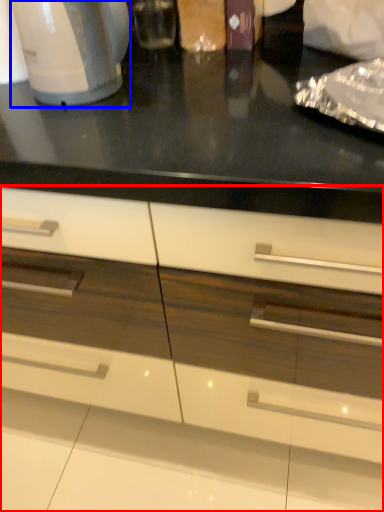
Question: Which of the following is the farthest to the observer, cabinetry (highlighted by a red box) or home appliance (highlighted by a blue box)?

Choices:
 (A) cabinetry
 (B) home appliance

Answer: (B)